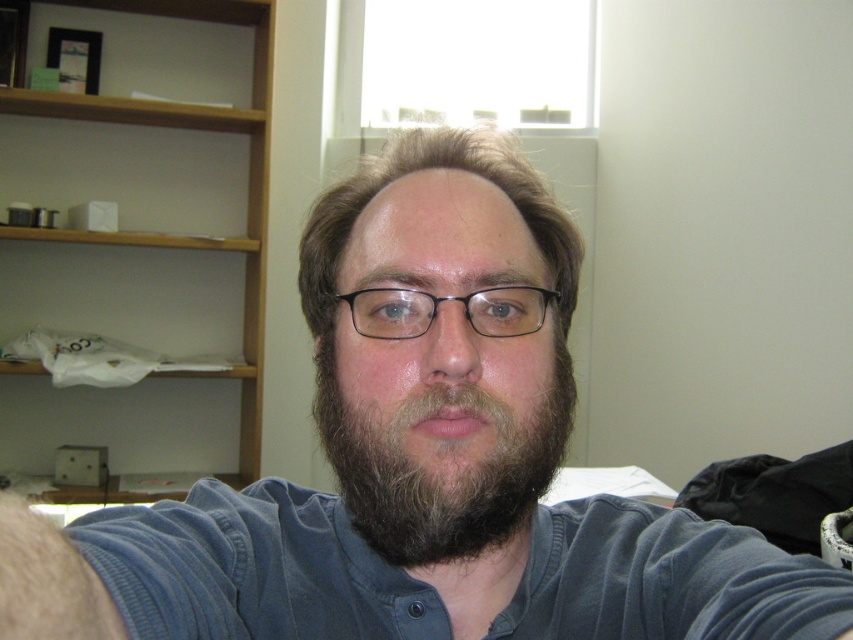
Does wooden bookshelf at upper left have a smaller size compared to dark brown fuzzy beard at center?

No.

Describe the element at coordinates (158, 241) in the screenshot. I see `wooden bookshelf at upper left` at that location.

This screenshot has height=640, width=853. Identify the location of wooden bookshelf at upper left. 158,241.

Identify the location of wooden bookshelf at upper left. The width and height of the screenshot is (853, 640). click(x=158, y=241).

At what (x,y) coordinates should I click in order to perform the action: click on dark brown fuzzy beard at center. Please return your answer as a coordinate pair (x, y). This screenshot has width=853, height=640. Looking at the image, I should click on (437, 474).

Consider the image. Is the position of dark brown fuzzy beard at center more distant than that of black plastic glasses at center?

No, dark brown fuzzy beard at center is in front of black plastic glasses at center.

The height and width of the screenshot is (640, 853). Describe the element at coordinates (437, 474) in the screenshot. I see `dark brown fuzzy beard at center` at that location.

You are a GUI agent. You are given a task and a screenshot of the screen. Output one action in this format:
    pyautogui.click(x=<x>, y=<y>)
    Task: Click on the dark brown fuzzy beard at center
    The image size is (853, 640).
    Given the screenshot: What is the action you would take?
    pyautogui.click(x=437, y=474)

Identify the location of wooden bookshelf at upper left. (158, 241).

Between point (303, 173) and point (486, 316), which one is positioned behind?

Positioned behind is point (303, 173).

Locate an element on the screen. Image resolution: width=853 pixels, height=640 pixels. wooden bookshelf at upper left is located at coordinates tap(158, 241).